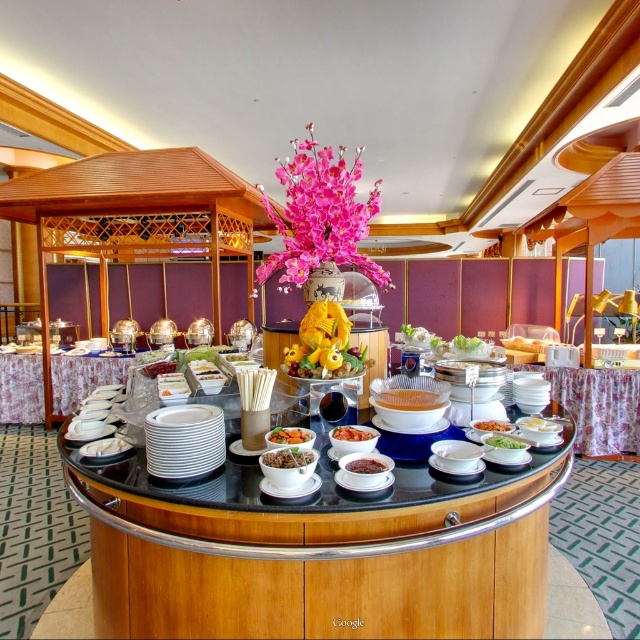
Can you confirm if white glossy plate at center is positioned to the left of smooth brown rice bowl at center?

Indeed, white glossy plate at center is positioned on the left side of smooth brown rice bowl at center.

Who is more distant from viewer, (x=99, y=442) or (x=307, y=433)?

Positioned behind is point (x=99, y=442).

Where is `white glossy plate at center`? The width and height of the screenshot is (640, 640). white glossy plate at center is located at coordinates (104, 448).

Does floral fabric tablecloth at right have a smaller size compared to yellow matte fruit at center?

No, floral fabric tablecloth at right is not smaller than yellow matte fruit at center.

Between floral fabric tablecloth at right and yellow matte fruit at center, which one is positioned lower?

floral fabric tablecloth at right is lower down.

This screenshot has width=640, height=640. What do you see at coordinates (600, 406) in the screenshot? I see `floral fabric tablecloth at right` at bounding box center [600, 406].

The width and height of the screenshot is (640, 640). Identify the location of floral fabric tablecloth at right. (600, 406).

Is point (296, 451) less distant than point (340, 436)?

Yes, it is.

Locate an element on the screen. slightly browned rice at center is located at coordinates (288, 458).